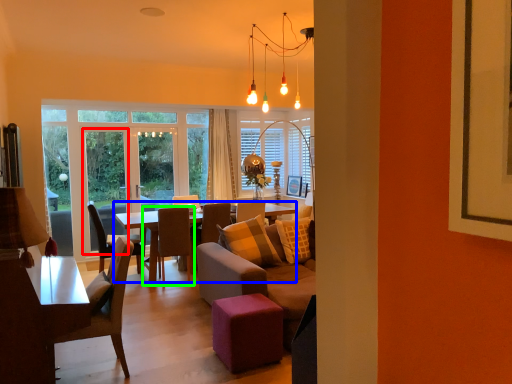
Question: Which object is the closest to the screen door (highlighted by a red box)? Choose among these: coffee table (highlighted by a blue box) or chair (highlighted by a green box).

Choices:
 (A) coffee table
 (B) chair

Answer: (A)